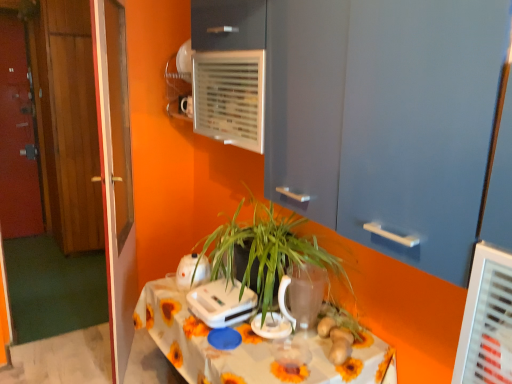
Where is `white floral tablecloth at center`? Image resolution: width=512 pixels, height=384 pixels. white floral tablecloth at center is located at coordinates (244, 347).

This screenshot has height=384, width=512. What do you see at coordinates (244, 347) in the screenshot?
I see `white floral tablecloth at center` at bounding box center [244, 347].

How much space does matte blue cabinet at upper center, placed as the 1th door when sorted from front to back, occupy horizontally?

matte blue cabinet at upper center, placed as the 1th door when sorted from front to back, is 13.97 inches wide.

This screenshot has width=512, height=384. Find the location of `white plastic air conditioning unit at upper center`. white plastic air conditioning unit at upper center is located at coordinates (230, 97).

Describe the element at coordinates (271, 326) in the screenshot. The height and width of the screenshot is (384, 512). I see `white glossy kettle at center, marked as the third appliance in a left-to-right arrangement` at that location.

Locate an element on the screen. Image resolution: width=512 pixels, height=384 pixels. wooden door at left, the second door when ordered from left to right is located at coordinates (70, 124).

The height and width of the screenshot is (384, 512). What do you see at coordinates (70, 124) in the screenshot? I see `wooden door at left, arranged as the third door when viewed from the front` at bounding box center [70, 124].

This screenshot has height=384, width=512. I want to click on white plastic toaster at center, which is counted as the third appliance, starting from the right, so click(192, 270).

Where is `white floral tablecloth at center`? This screenshot has width=512, height=384. white floral tablecloth at center is located at coordinates (244, 347).

From the image's perspective, does green matte plant at center appear lower than matte blue cabinet at upper center, acting as the fourth door starting from the back?

Yes, from the image's perspective, green matte plant at center is below matte blue cabinet at upper center, acting as the fourth door starting from the back.

Are green matte plant at center and matte blue cabinet at upper center, placed as the 1th door when sorted from front to back, located far from each other?

That's not correct — green matte plant at center is a little close to matte blue cabinet at upper center, placed as the 1th door when sorted from front to back.

The image size is (512, 384). I want to click on houseplant on the left side of matte blue cabinet at upper center, the 4th door when ordered from left to right, so click(x=265, y=253).

Is point (274, 237) closer to viewer compared to point (368, 47)?

No.

Which object is further away from the camera, green matte plant at center or white floral tablecloth at center?

green matte plant at center is behind.

Is green matte plant at center looking in the opposite direction of white floral tablecloth at center?

No, white floral tablecloth at center is not at the back of green matte plant at center.

From the red wooden door at left, which is the first door in left-to-right order, count 3rd door to the right and point to it. Please provide its 2D coordinates.

[(421, 127)]

Consider the image. Looking at their sizes, would you say red wooden door at left, which appears as the 4th door when viewed from the right, is wider or thinner than matte blue cabinet at upper center, placed as the 1th door when sorted from front to back?

Clearly, red wooden door at left, which appears as the 4th door when viewed from the right, has less width compared to matte blue cabinet at upper center, placed as the 1th door when sorted from front to back.

Which is farther from the camera, (24, 33) or (359, 171)?

The point (24, 33) is more distant.

Can you confirm if red wooden door at left, which appears as the 4th door when viewed from the right, is taller than matte blue cabinet at upper center, acting as the fourth door starting from the back?

Yes, red wooden door at left, which appears as the 4th door when viewed from the right, is taller than matte blue cabinet at upper center, acting as the fourth door starting from the back.

Considering the relative sizes of wooden door at left, placed as the third door when sorted from back to front, and green matte plant at center in the image provided, is wooden door at left, placed as the third door when sorted from back to front, wider than green matte plant at center?

No, wooden door at left, placed as the third door when sorted from back to front, is not wider than green matte plant at center.

Considering the positions of point (65, 80) and point (256, 209), is point (65, 80) closer or farther from the camera than point (256, 209)?

Clearly, point (65, 80) is more distant from the camera than point (256, 209).

Considering the positions of objects wooden door at left, placed as the third door when sorted from back to front, and green matte plant at center in the image provided, who is in front, wooden door at left, placed as the third door when sorted from back to front, or green matte plant at center?

green matte plant at center is closer to the camera.

There is a green matte plant at center. Where is `the 1st door above it (from a real-world perspective)`? the 1st door above it (from a real-world perspective) is located at coordinates (69, 122).

Could you measure the distance between red wooden door at left, which is the 4th door from front to back, and transparent glass vase at center?

red wooden door at left, which is the 4th door from front to back, is 3.34 meters away from transparent glass vase at center.

Can you confirm if red wooden door at left, which is the first door in left-to-right order, is bigger than transparent glass vase at center?

Yes.

Which point is more distant from viewer, (21, 116) or (310, 265)?

The point (21, 116) is farther from the camera.

In the scene shown: Is red wooden door at left, which appears as the 4th door when viewed from the right, far from transparent glass vase at center?

Indeed, red wooden door at left, which appears as the 4th door when viewed from the right, is not near transparent glass vase at center.

How different are the orientations of white plastic appliance at center, the 2th appliance positioned from the right, and red wooden door at left, which is the 1th door in back-to-front order, in degrees?

84.2 degrees separate the facing orientations of white plastic appliance at center, the 2th appliance positioned from the right, and red wooden door at left, which is the 1th door in back-to-front order.

Choose the correct answer: Is white plastic appliance at center, the second appliance from the left, inside red wooden door at left, which appears as the 4th door when viewed from the right, or outside it?

white plastic appliance at center, the second appliance from the left, is spatially situated outside red wooden door at left, which appears as the 4th door when viewed from the right.

Considering the relative sizes of white plastic appliance at center, the 2th appliance positioned from the right, and red wooden door at left, which is the 1th door in back-to-front order, in the image provided, is white plastic appliance at center, the 2th appliance positioned from the right, shorter than red wooden door at left, which is the 1th door in back-to-front order,?

Correct, white plastic appliance at center, the 2th appliance positioned from the right, is not as tall as red wooden door at left, which is the 1th door in back-to-front order.

From the image's perspective, which is above, white glossy kettle at center, marked as the third appliance in a left-to-right arrangement, or brown matte ginger at center?

white glossy kettle at center, marked as the third appliance in a left-to-right arrangement.

Based on the photo, from a real-world perspective, is white glossy kettle at center, which is the 1th appliance in right-to-left order, over brown matte ginger at center?

Incorrect, from a real-world perspective, white glossy kettle at center, which is the 1th appliance in right-to-left order, is lower than brown matte ginger at center.

Between white glossy kettle at center, marked as the third appliance in a left-to-right arrangement, and brown matte ginger at center, which one appears on the left side from the viewer's perspective?

white glossy kettle at center, marked as the third appliance in a left-to-right arrangement, is more to the left.

Is white glossy kettle at center, marked as the third appliance in a left-to-right arrangement, in contact with brown matte ginger at center?

No, white glossy kettle at center, marked as the third appliance in a left-to-right arrangement, is not touching brown matte ginger at center.

The image size is (512, 384). What are the coordinates of `door located in front of the green matte plant at center` in the screenshot? It's located at (421, 127).

Locate an element on the screen. The image size is (512, 384). houseplant that is behind the white floral tablecloth at center is located at coordinates (265, 253).

Considering their positions, is white floral tablecloth at center positioned closer to transparent glass vase at center than green matte plant at center?

green matte plant at center lies closer to transparent glass vase at center than the other object.

Considering their positions, is matte blue cabinet at upper center, placed as the 1th door when sorted from front to back, positioned closer to wooden door at left, which is the second door from right to left, than white floral tablecloth at center?

Among the two, white floral tablecloth at center is located nearer to wooden door at left, which is the second door from right to left.

Which object lies further to the anchor point red wooden door at left, which appears as the 4th door when viewed from the right, white plastic appliance at center, the second appliance from the left, or white glossy kettle at center, marked as the third appliance in a left-to-right arrangement?

Based on the image, white glossy kettle at center, marked as the third appliance in a left-to-right arrangement, appears to be further to red wooden door at left, which appears as the 4th door when viewed from the right.

Looking at the image, which one is located closer to brown matte ginger at center, wooden door at left, acting as the second door starting from the front, or matte blue cabinet at upper center, placed as the 1th door when sorted from front to back?

matte blue cabinet at upper center, placed as the 1th door when sorted from front to back, is positioned closer to the anchor brown matte ginger at center.

Which object lies further to the anchor point transparent glass door at left, white glossy kettle at center, which is the 1th appliance in right-to-left order, or brown matte ginger at center?

Based on the image, brown matte ginger at center appears to be further to transparent glass door at left.

Estimate the real-world distances between objects in this image. Which object is closer to green matte plant at center, white plastic appliance at center, the second appliance from the left, or white plastic toaster at center, the 1th appliance from the left?

white plastic appliance at center, the second appliance from the left, is closer to green matte plant at center.

Estimate the real-world distances between objects in this image. Which object is closer to transparent glass vase at center, wooden door at left, which is the second door from right to left, or transparent glass door at left?

The object closer to transparent glass vase at center is transparent glass door at left.

When comparing their distances from white plastic appliance at center, the 2th appliance positioned from the right, does transparent glass vase at center or transparent glass door at left seem closer?

transparent glass vase at center lies closer to white plastic appliance at center, the 2th appliance positioned from the right, than the other object.

The height and width of the screenshot is (384, 512). I want to click on houseplant between white floral tablecloth at center and white plastic toaster at center, which is counted as the third appliance, starting from the right, along the z-axis, so click(x=265, y=253).

Where is `glass vase located between white floral tablecloth at center and wooden door at left, placed as the third door when sorted from right to left, in the depth direction`? The width and height of the screenshot is (512, 384). glass vase located between white floral tablecloth at center and wooden door at left, placed as the third door when sorted from right to left, in the depth direction is located at coordinates (302, 295).

At what (x,y) coordinates should I click in order to perform the action: click on food between matte blue cabinet at upper center, the 4th door when ordered from left to right, and white floral tablecloth at center, in the vertical direction. Please return your answer as a coordinate pair (x, y). The width and height of the screenshot is (512, 384). Looking at the image, I should click on (340, 350).

Locate an element on the screen. This screenshot has width=512, height=384. glass door situated between wooden door at left, acting as the 3th door starting from the left, and white plastic air conditioning unit at upper center from left to right is located at coordinates (115, 173).